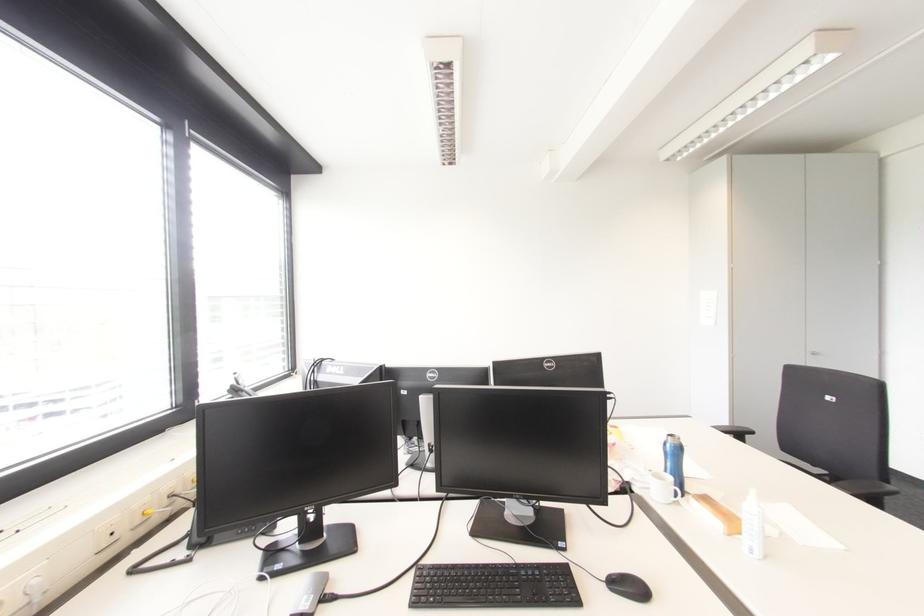
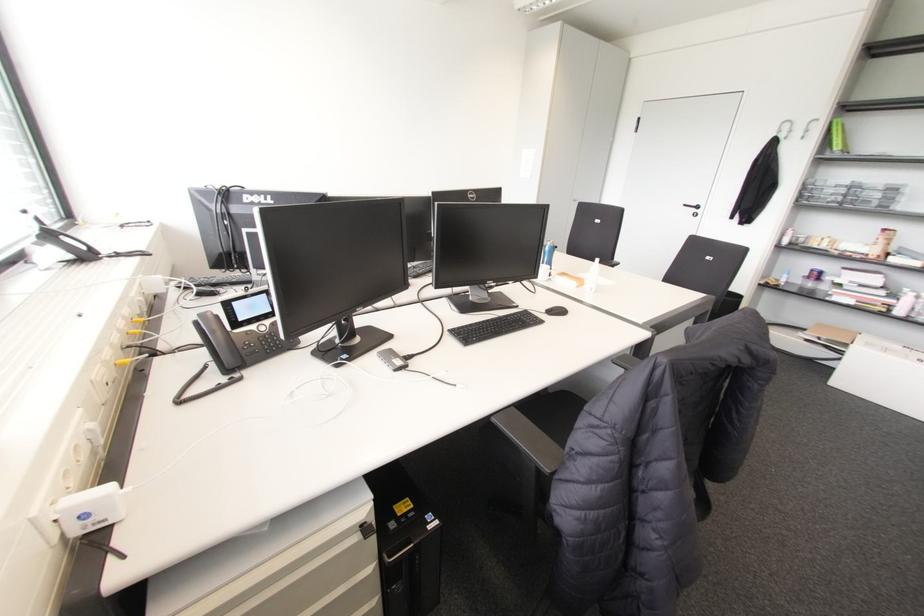
Locate, in the second image, the point that corresponds to point 749,539 in the first image.

(589, 285)